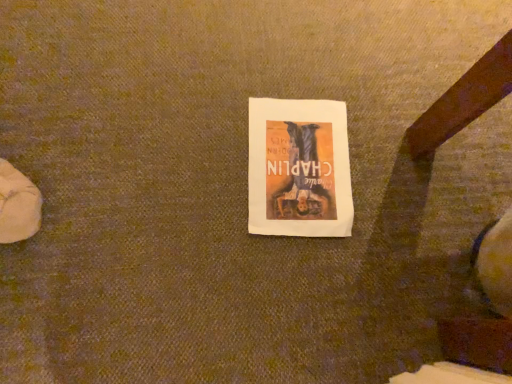
Where is `white fabric shoe at left`? white fabric shoe at left is located at coordinates (18, 205).

Measure the distance between point (10, 235) and camera.

The depth of point (10, 235) is 28.66 inches.

Describe the element at coordinates (18, 205) in the screenshot. I see `white fabric shoe at left` at that location.

You are a GUI agent. You are given a task and a screenshot of the screen. Output one action in this format:
    pyautogui.click(x=<x>, y=<y>)
    Task: Click on the white fabric shoe at left
    
    Given the screenshot: What is the action you would take?
    pyautogui.click(x=18, y=205)